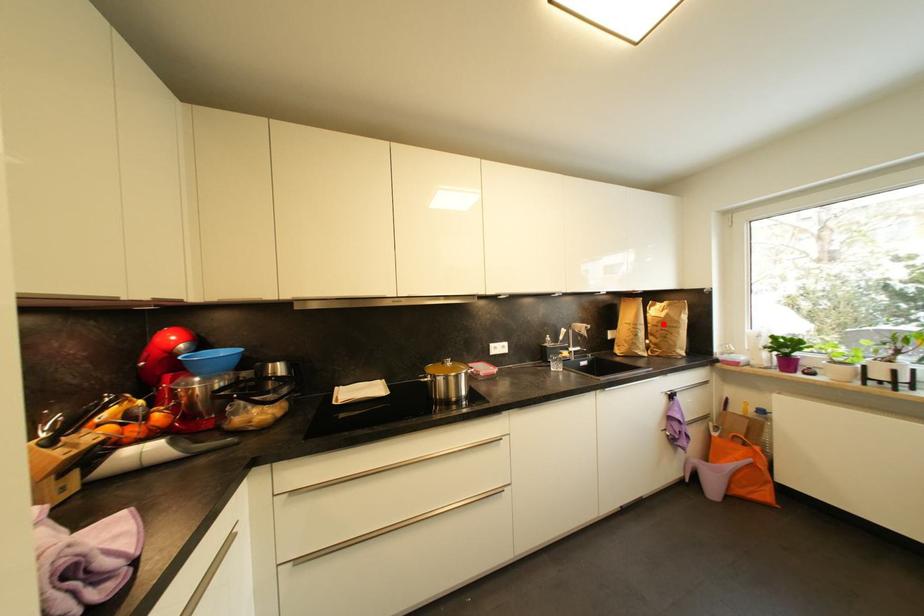
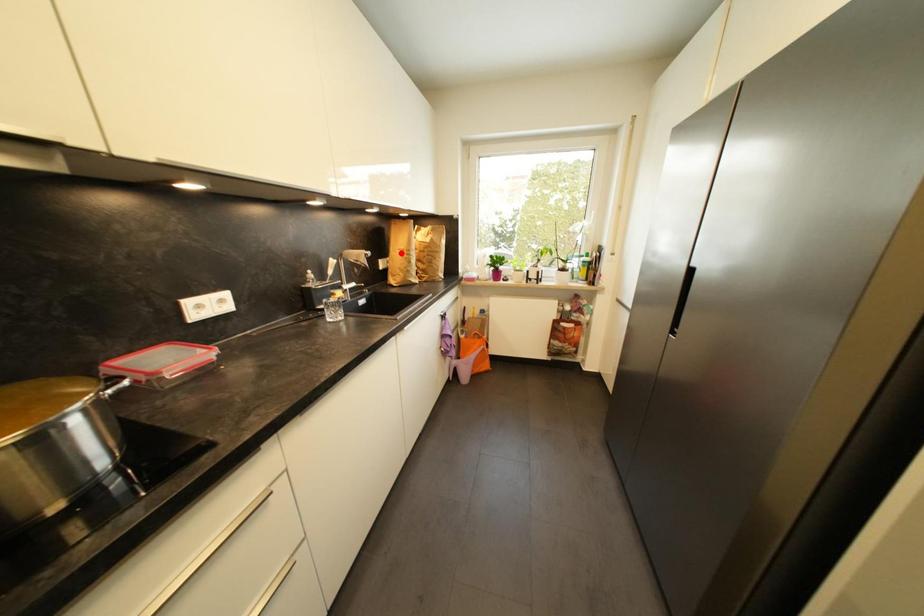
I am providing you with two images of the same scene from different viewpoints. A red point is marked on the first image and another point is marked on the second image. Do the highlighted points in image1 and image2 indicate the same real-world spot?

No